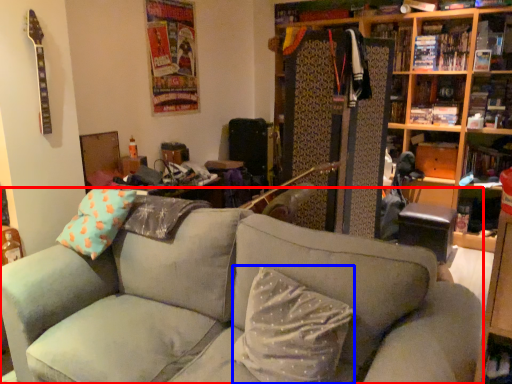
Question: Which point is closer to the camera, studio couch (highlighted by a red box) or pillow (highlighted by a blue box)?

Choices:
 (A) studio couch
 (B) pillow

Answer: (A)